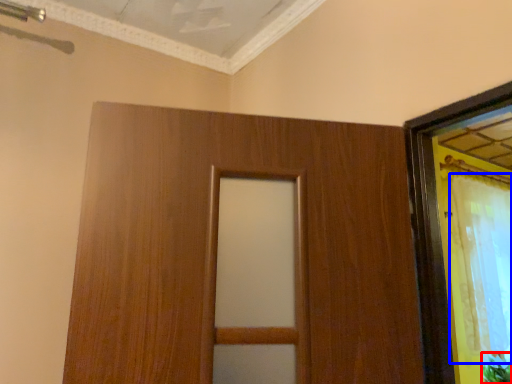
Question: Which point is further to the camera, plant (highlighted by a red box) or curtain (highlighted by a blue box)?

Choices:
 (A) plant
 (B) curtain

Answer: (A)